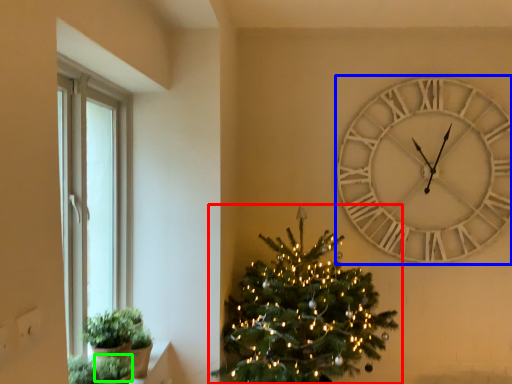
Question: Estimate the real-world distances between objects in this image. Which object is closer to christmas tree (highlighted by a red box), wall clock (highlighted by a blue box) or plant (highlighted by a green box)?

Choices:
 (A) wall clock
 (B) plant

Answer: (A)